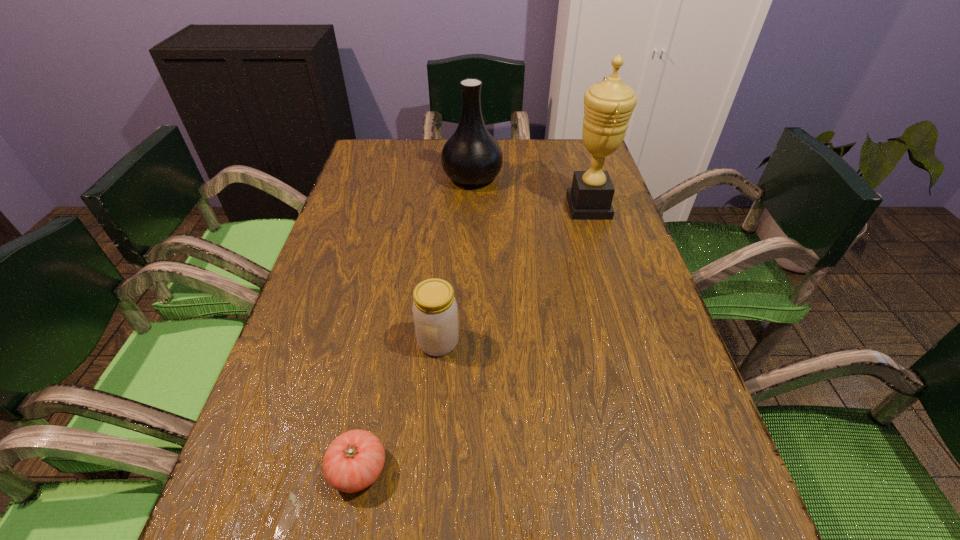
This screenshot has height=540, width=960. Identify the location of free space located 0.120m on the back of the vase. (473, 144).

Image resolution: width=960 pixels, height=540 pixels. Identify the location of vacant space located 0.150m on the left of the third tallest object. (343, 342).

The width and height of the screenshot is (960, 540). In order to click on free location located 0.110m on the left of the shortest object in this screenshot , I will do `click(260, 469)`.

Image resolution: width=960 pixels, height=540 pixels. Identify the location of object that is positioned at the far edge. click(x=472, y=156).

Where is `object that is at the left edge`? Image resolution: width=960 pixels, height=540 pixels. object that is at the left edge is located at coordinates (353, 461).

Find the location of a particular element. The height and width of the screenshot is (540, 960). object that is at the right edge is located at coordinates (608, 105).

Where is `vacant position at the far edge of the desktop`? The image size is (960, 540). vacant position at the far edge of the desktop is located at coordinates (546, 146).

This screenshot has width=960, height=540. I want to click on free space at the left edge of the desktop, so click(320, 291).

In the image, there is a desktop. In order to click on vacant space at the right edge in this screenshot , I will do `click(616, 345)`.

Identify the location of vacant space at the far left corner of the desktop. (375, 165).